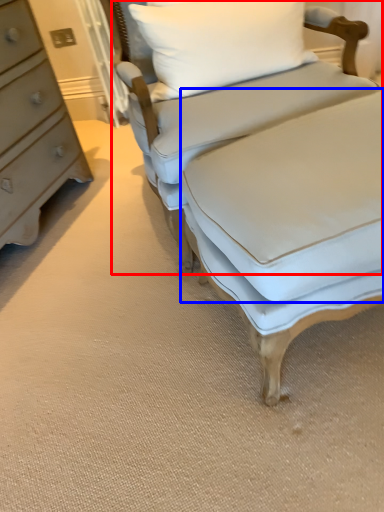
Question: Which object is closer to the camera taking this photo, studio couch (highlighted by a red box) or sheet (highlighted by a blue box)?

Choices:
 (A) studio couch
 (B) sheet

Answer: (B)